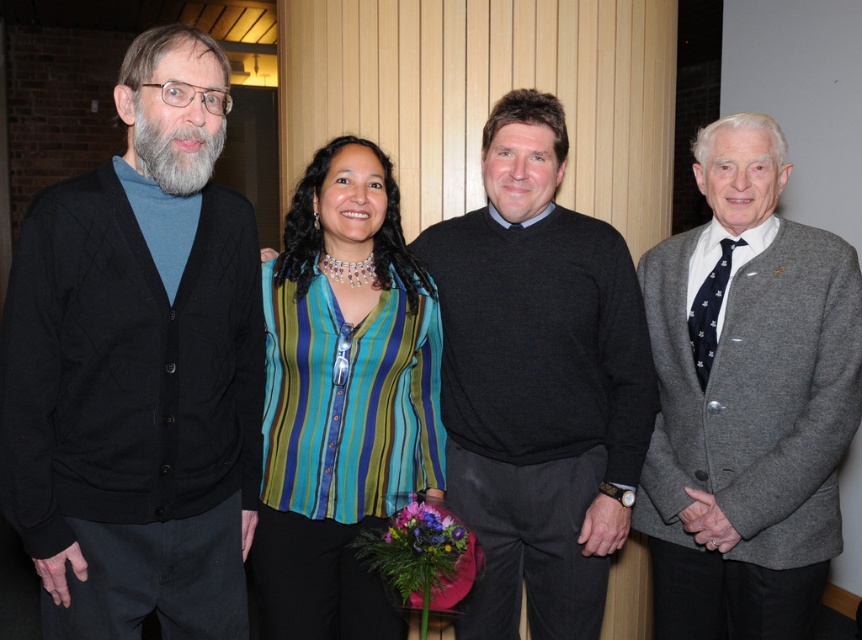
Looking at this image, you are standing in front of the image. Where is the black cardigan at left located in terms of coordinates?

The black cardigan at left is located at coordinates point [138,368].

You are a photographer at the event and want to ensure that the black cardigan at left and the striped fabric blouse at center are both visible in the photo. Based on their positions, which clothing item is covering part of the other?

The black cardigan at left is positioned over the striped fabric blouse at center, so it is covering part of it.